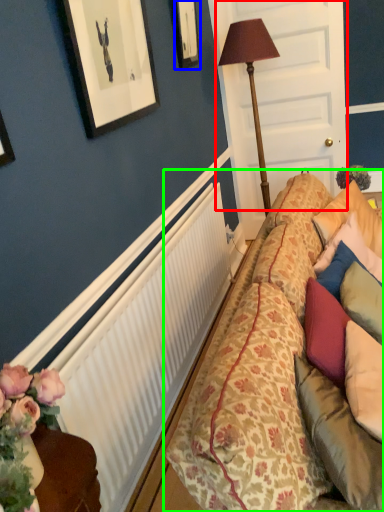
Question: Which object is the closest to the door (highlighted by a red box)? Choose among these: picture frame (highlighted by a blue box) or studio couch (highlighted by a green box).

Choices:
 (A) picture frame
 (B) studio couch

Answer: (A)